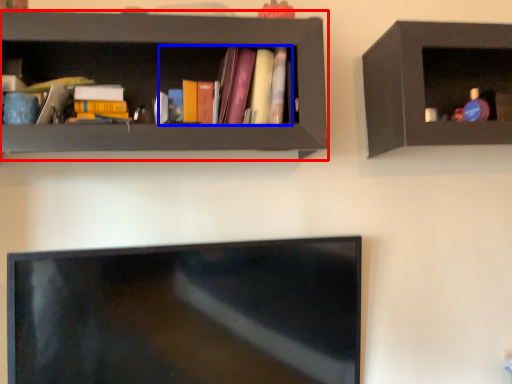
Question: Which object is further to the camera taking this photo, shelf (highlighted by a red box) or book (highlighted by a blue box)?

Choices:
 (A) shelf
 (B) book

Answer: (B)